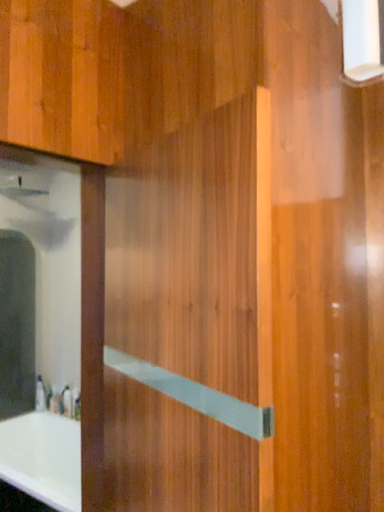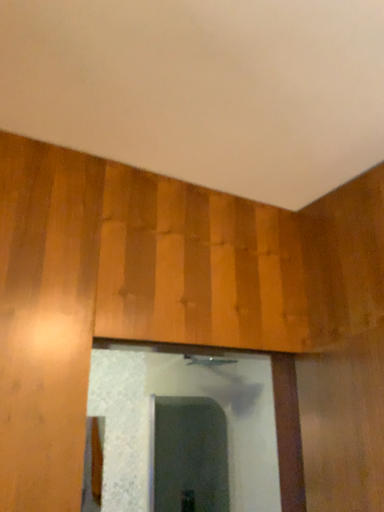
Question: Which way did the camera rotate in the video?

Choices:
 (A) rotated downward
 (B) rotated upward

Answer: (B)